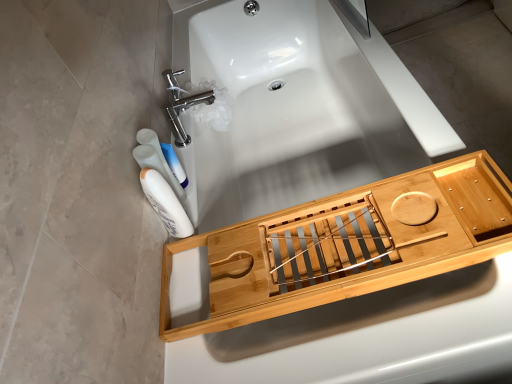
The height and width of the screenshot is (384, 512). Identify the location of free point in front of white glossy mouthwash at left, the second mouthwash when ordered from back to front. (192, 286).